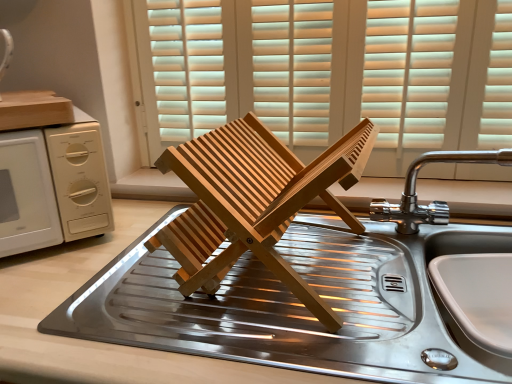
This screenshot has height=384, width=512. What do you see at coordinates (53, 186) in the screenshot?
I see `white matte microwave at left` at bounding box center [53, 186].

Where is `white matte microwave at left`? This screenshot has height=384, width=512. white matte microwave at left is located at coordinates (53, 186).

Do you think white matte microwave at left is within stainless steel sink at center, or outside of it?

white matte microwave at left is not inside stainless steel sink at center, it's outside.

Considering the positions of points (27, 206) and (307, 314), is point (27, 206) closer to camera compared to point (307, 314)?

No, it is behind (307, 314).

Considering the sizes of white matte microwave at left and stainless steel sink at center in the image, is white matte microwave at left wider or thinner than stainless steel sink at center?

Considering their sizes, white matte microwave at left looks slimmer than stainless steel sink at center.

Would you say wooden blinds at center is to the left or to the right of chrome metallic faucet at upper right in the picture?

Based on their positions, wooden blinds at center is located to the left of chrome metallic faucet at upper right.

Is wooden blinds at center wider or thinner than chrome metallic faucet at upper right?

Clearly, wooden blinds at center has less width compared to chrome metallic faucet at upper right.

Measure the distance from wooden blinds at center to chrome metallic faucet at upper right.

wooden blinds at center is 13.15 inches from chrome metallic faucet at upper right.

From a real-world perspective, who is located higher, wooden blinds at center or chrome metallic faucet at upper right?

In real-world perspective, wooden blinds at center is above.

Would you say chrome metallic faucet at upper right is part of stainless steel sink at center's contents?

Actually, chrome metallic faucet at upper right is outside stainless steel sink at center.

Which is more to the right, stainless steel sink at center or chrome metallic faucet at upper right?

chrome metallic faucet at upper right is more to the right.

Is stainless steel sink at center wider or thinner than chrome metallic faucet at upper right?

Considering their sizes, stainless steel sink at center looks broader than chrome metallic faucet at upper right.

From the image's perspective, which object appears higher, stainless steel sink at center or chrome metallic faucet at upper right?

chrome metallic faucet at upper right, from the image's perspective.

Does chrome metallic faucet at upper right contain white matte microwave at left?

No, white matte microwave at left is not inside chrome metallic faucet at upper right.

In the scene shown: From the image's perspective, is chrome metallic faucet at upper right over white matte microwave at left?

No, from the image's perspective, chrome metallic faucet at upper right is not on top of white matte microwave at left.

Where is `tap located above the white matte microwave at left (from a real-world perspective)`? Image resolution: width=512 pixels, height=384 pixels. tap located above the white matte microwave at left (from a real-world perspective) is located at coordinates (433, 201).

Is chrome metallic faucet at upper right taller or shorter than white matte microwave at left?

Considering their sizes, chrome metallic faucet at upper right has less height than white matte microwave at left.

From the image's perspective, relative to chrome metallic faucet at upper right, is white matte microwave at left above or below?

Based on their image positions, white matte microwave at left is located above chrome metallic faucet at upper right.

Consider the image. Which of these two, white matte microwave at left or chrome metallic faucet at upper right, is bigger?

Bigger between the two is white matte microwave at left.

Does point (72, 230) come in front of point (431, 217)?

Yes, point (72, 230) is in front of point (431, 217).

Between white matte microwave at left and chrome metallic faucet at upper right, which one appears on the right side from the viewer's perspective?

chrome metallic faucet at upper right.

From a real-world perspective, between white matte microwave at left and wooden blinds at center, who is vertically lower?

From a 3D spatial view, white matte microwave at left is below.

Is white matte microwave at left not inside wooden blinds at center?

Absolutely, white matte microwave at left is external to wooden blinds at center.

Who is taller, white matte microwave at left or wooden blinds at center?

wooden blinds at center is taller.

Is wooden blinds at center at the back of white matte microwave at left?

No, wooden blinds at center is not at the back of white matte microwave at left.

Which object is thinner, wooden blinds at center or stainless steel sink at center?

Thinner between the two is wooden blinds at center.

Can you confirm if wooden blinds at center is bigger than stainless steel sink at center?

No, wooden blinds at center is not bigger than stainless steel sink at center.

Is point (295, 99) closer to viewer compared to point (489, 232)?

No.

The image size is (512, 384). I want to click on sink that is below the white matte microwave at left (from the image's perspective), so pyautogui.click(x=297, y=305).

Where is `window on the left side of chrome metallic faucet at upper right`? The width and height of the screenshot is (512, 384). window on the left side of chrome metallic faucet at upper right is located at coordinates (329, 73).

Estimate the real-world distances between objects in this image. Which object is closer to white matte microwave at left, wooden blinds at center or chrome metallic faucet at upper right?

wooden blinds at center.

Which object lies nearer to the anchor point chrome metallic faucet at upper right, stainless steel sink at center or white matte microwave at left?

stainless steel sink at center is closer to chrome metallic faucet at upper right.

Based on their spatial positions, is stainless steel sink at center or chrome metallic faucet at upper right further from wooden blinds at center?

stainless steel sink at center is positioned further to the anchor wooden blinds at center.

Based on their spatial positions, is wooden blinds at center or chrome metallic faucet at upper right closer to stainless steel sink at center?

chrome metallic faucet at upper right is positioned closer to the anchor stainless steel sink at center.

From the image, which object appears to be nearer to stainless steel sink at center, white matte microwave at left or chrome metallic faucet at upper right?

The object closer to stainless steel sink at center is chrome metallic faucet at upper right.

Considering their positions, is chrome metallic faucet at upper right positioned further to wooden blinds at center than white matte microwave at left?

The object further to wooden blinds at center is white matte microwave at left.

Looking at the image, which one is located closer to chrome metallic faucet at upper right, wooden blinds at center or stainless steel sink at center?

stainless steel sink at center lies closer to chrome metallic faucet at upper right than the other object.

Which object lies nearer to the anchor point wooden blinds at center, stainless steel sink at center or white matte microwave at left?

The object closer to wooden blinds at center is stainless steel sink at center.

This screenshot has height=384, width=512. What are the coordinates of `sink between white matte microwave at left and chrome metallic faucet at upper right from left to right` in the screenshot? It's located at (297, 305).

Locate an element on the screen. sink located between white matte microwave at left and wooden blinds at center in the left-right direction is located at coordinates (297, 305).

Locate an element on the screen. tap between wooden blinds at center and stainless steel sink at center vertically is located at coordinates (433, 201).

I want to click on window between white matte microwave at left and chrome metallic faucet at upper right in the horizontal direction, so click(329, 73).